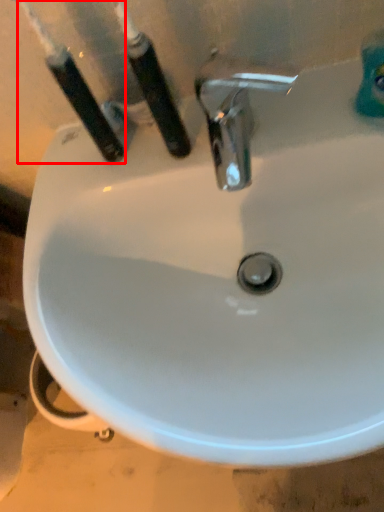
Question: In this image, where is toothbrush (annotated by the red box) located relative to toothbrush?

Choices:
 (A) left
 (B) right

Answer: (A)